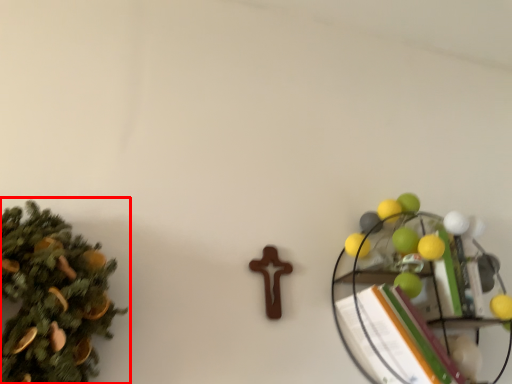
Question: From the image's perspective, what is the correct spatial positioning of christmas tree (annotated by the red box) in reference to shelf?

Choices:
 (A) above
 (B) below

Answer: (A)